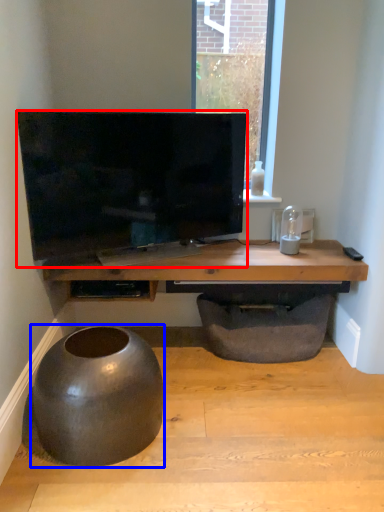
Question: Among these objects, which one is nearest to the camera, television (highlighted by a red box) or round table (highlighted by a blue box)?

Choices:
 (A) television
 (B) round table

Answer: (B)